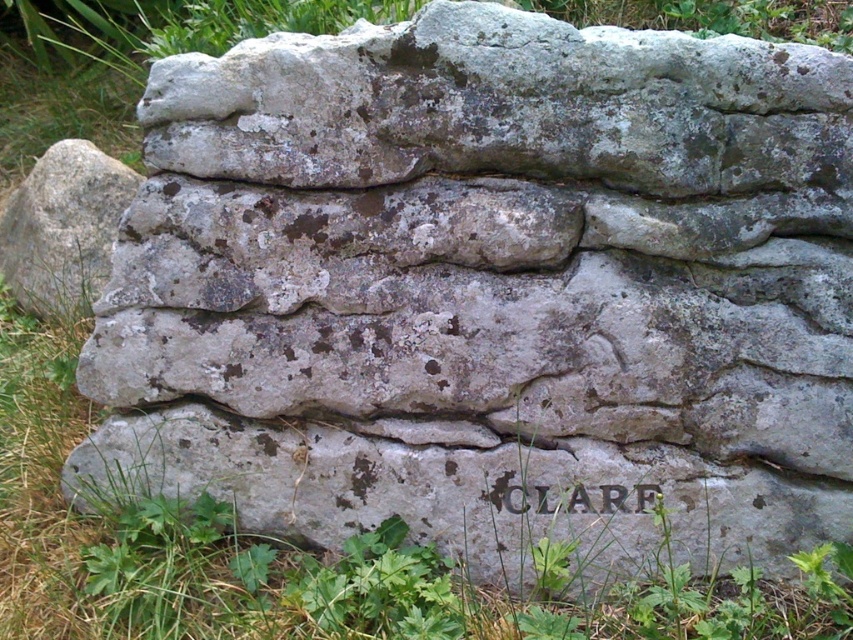
Between gray rough stone at left and carved stone lettering at center, which one is positioned higher?

gray rough stone at left is higher up.

Is gray rough stone at left positioned before carved stone lettering at center?

No, it is not.

This screenshot has height=640, width=853. Identify the location of gray rough stone at left. (62, 228).